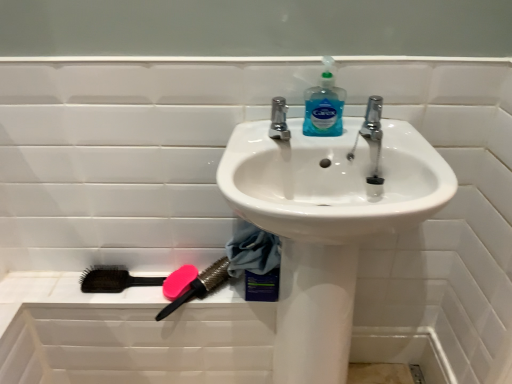
Question: Would you say white glossy sink at center is a long distance from pink rubber soap at lower left?

Choices:
 (A) no
 (B) yes

Answer: (A)

Question: Is white glossy sink at center at the right side of pink rubber soap at lower left?

Choices:
 (A) no
 (B) yes

Answer: (B)

Question: Would you say white glossy sink at center is outside pink rubber soap at lower left?

Choices:
 (A) no
 (B) yes

Answer: (B)

Question: Is white glossy sink at center taller than pink rubber soap at lower left?

Choices:
 (A) no
 (B) yes

Answer: (B)

Question: Could you tell me if white glossy sink at center is facing pink rubber soap at lower left?

Choices:
 (A) yes
 (B) no

Answer: (B)

Question: Can you confirm if white glossy sink at center is thinner than pink rubber soap at lower left?

Choices:
 (A) yes
 (B) no

Answer: (B)

Question: Is pink rubber brush at lower left, which appears as the 1th brush when viewed from the right, not close to white glossy sink at center?

Choices:
 (A) yes
 (B) no

Answer: (B)

Question: Is pink rubber brush at lower left, which is the second brush in left-to-right order, oriented away from white glossy sink at center?

Choices:
 (A) yes
 (B) no

Answer: (B)

Question: Is pink rubber brush at lower left, which is the second brush in left-to-right order, thinner than white glossy sink at center?

Choices:
 (A) yes
 (B) no

Answer: (A)

Question: From the image's perspective, is pink rubber brush at lower left, which appears as the 1th brush when viewed from the right, located beneath white glossy sink at center?

Choices:
 (A) yes
 (B) no

Answer: (B)

Question: Considering the relative sizes of pink rubber brush at lower left, which appears as the 1th brush when viewed from the right, and white glossy sink at center in the image provided, is pink rubber brush at lower left, which appears as the 1th brush when viewed from the right, bigger than white glossy sink at center?

Choices:
 (A) yes
 (B) no

Answer: (B)

Question: From a real-world perspective, is pink rubber brush at lower left, which appears as the 1th brush when viewed from the right, on top of white glossy sink at center?

Choices:
 (A) no
 (B) yes

Answer: (A)

Question: From a real-world perspective, is pink rubber soap at lower left on pink rubber brush at lower left, which is the second brush in left-to-right order?

Choices:
 (A) no
 (B) yes

Answer: (A)